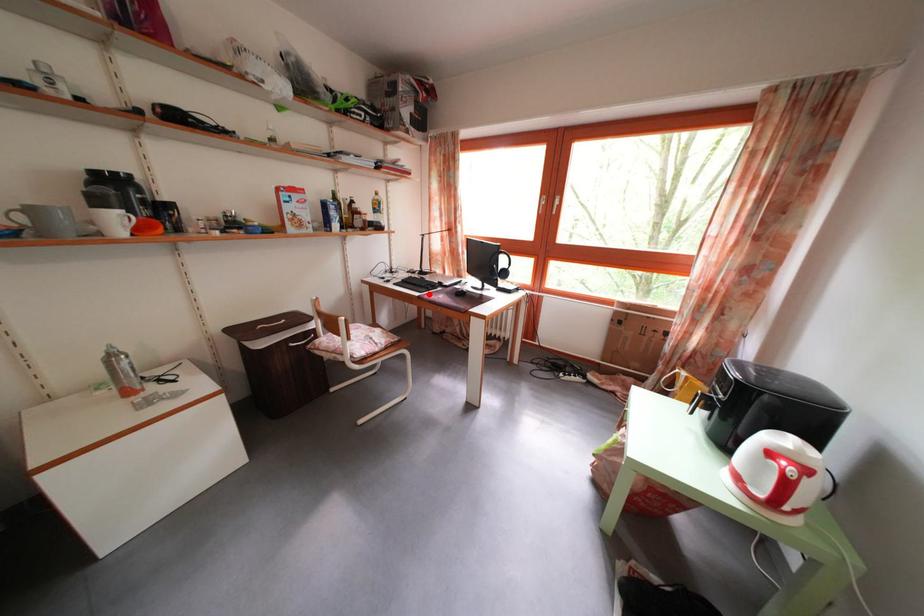
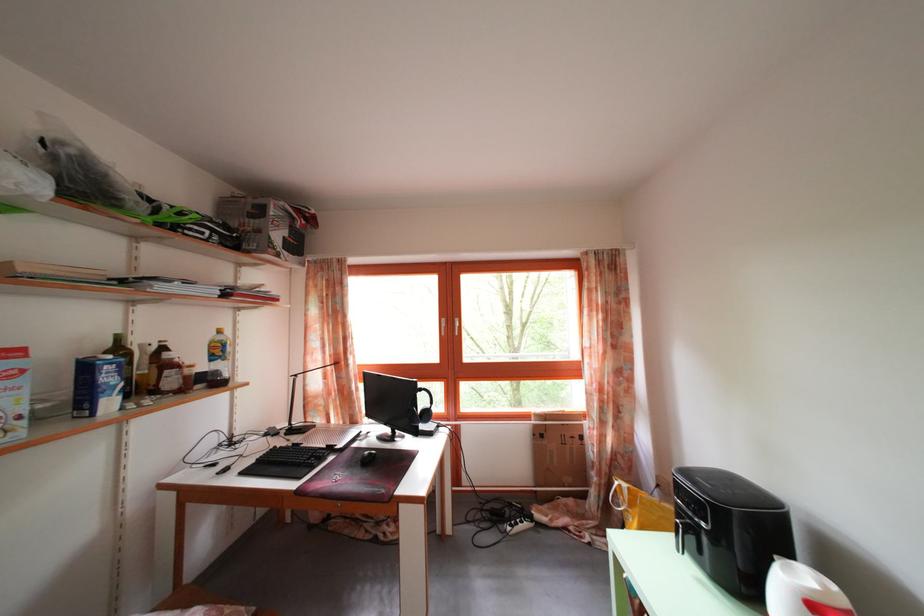
Locate, in the second image, the point that corresponds to the highlighted location in the first image.

(307, 472)